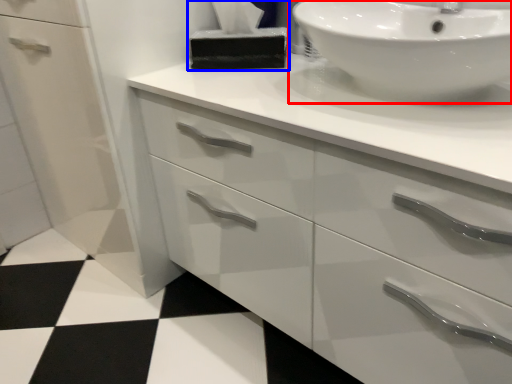
Question: Among these objects, which one is farthest to the camera, sink (highlighted by a red box) or tissue (highlighted by a blue box)?

Choices:
 (A) sink
 (B) tissue

Answer: (B)